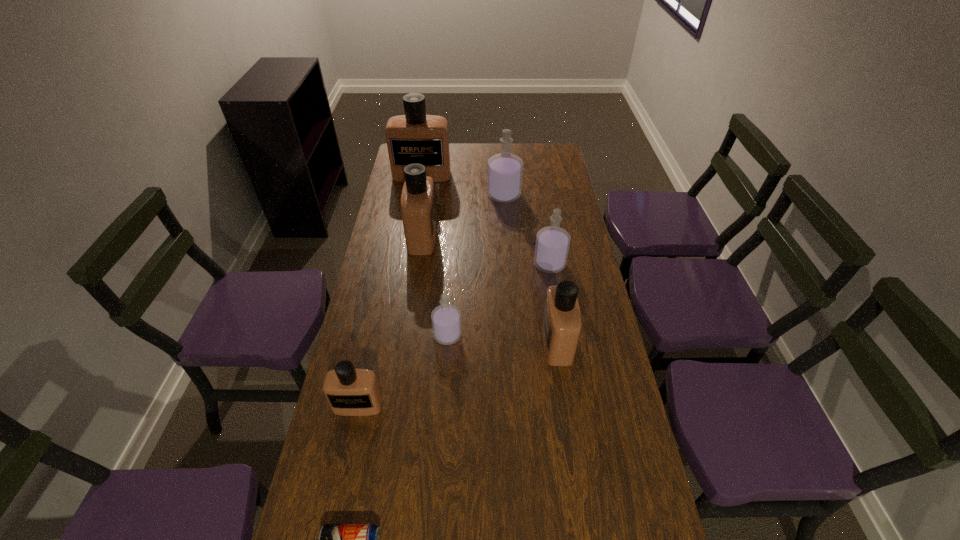
The height and width of the screenshot is (540, 960). I want to click on free space located 0.380m on the back of the smallest purple perfume, so (453, 246).

Locate an element on the screen. vacant point located 0.250m on the front label of the seventh farthest object is located at coordinates (334, 519).

You are a GUI agent. You are given a task and a screenshot of the screen. Output one action in this format:
    pyautogui.click(x=<x>, y=<y>)
    Task: Click on the object positioned at the far edge
    
    Given the screenshot: What is the action you would take?
    pyautogui.click(x=415, y=137)

This screenshot has height=540, width=960. What are the coordinates of `object that is at the far left corner` in the screenshot? It's located at (415, 137).

Identify the location of free spot at the left edge of the desktop. (403, 249).

Image resolution: width=960 pixels, height=540 pixels. In the image, there is a desktop. Identify the location of free space at the right edge. (571, 275).

Identify the location of vacant space at the far right corner of the desktop. The image size is (960, 540). (542, 149).

Locate an element on the screen. The width and height of the screenshot is (960, 540). vacant area that lies between the third perfume from right to left and the smallest purple perfume is located at coordinates (476, 265).

I want to click on free point between the nearest perfume and the smallest purple perfume, so click(403, 370).

Find the location of a particular element. This screenshot has height=540, width=960. vacant space in between the smallest beige perfume and the second biggest beige perfume is located at coordinates (391, 321).